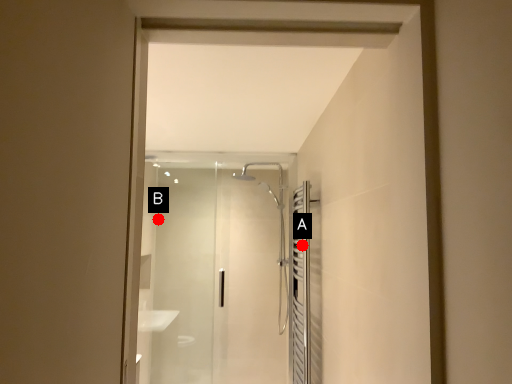
Question: Two points are circled on the image, labeled by A and B beside each circle. Which point is closer to the camera taking this photo?

Choices:
 (A) A is closer
 (B) B is closer

Answer: (A)